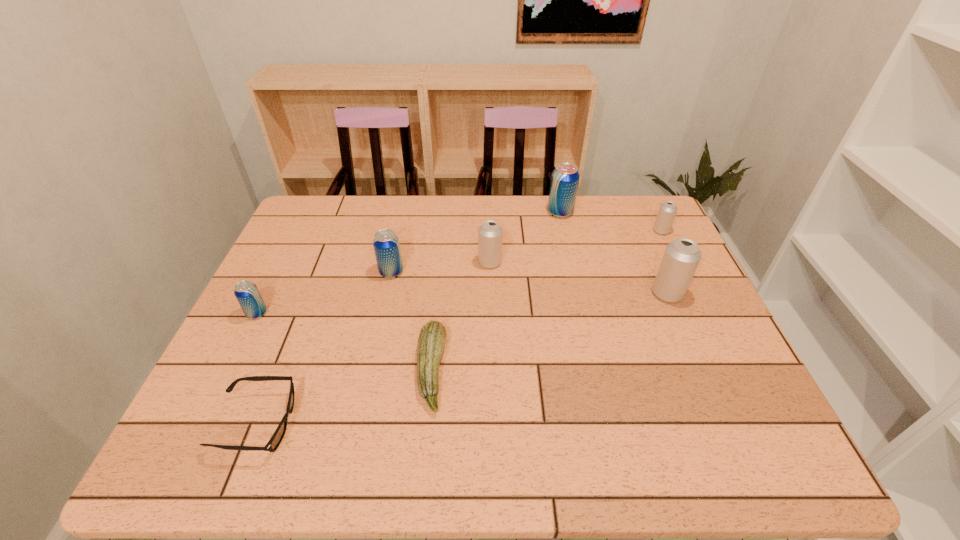
Identify the location of the second farthest beer can. This screenshot has width=960, height=540. (667, 211).

Locate an element on the screen. The height and width of the screenshot is (540, 960). the second farthest object is located at coordinates (667, 211).

Identify the location of the second shortest object. The width and height of the screenshot is (960, 540). (432, 338).

Find the location of a particular element. This screenshot has height=540, width=960. the fifth object from right to left is located at coordinates (432, 338).

Locate an element on the screen. sunglasses is located at coordinates (275, 440).

Locate an element on the screen. the second object from left to right is located at coordinates (275, 440).

You are a GUI agent. You are given a task and a screenshot of the screen. Output one action in this format:
    pyautogui.click(x=<x>, y=<y>)
    Task: Click on the vacant space located 0.260m on the front of the fourth beer can from left to right
    This screenshot has width=960, height=540.
    Given the screenshot: What is the action you would take?
    pyautogui.click(x=574, y=274)

Where is `vacant space located on the left of the biggest white beer can`? vacant space located on the left of the biggest white beer can is located at coordinates (578, 293).

This screenshot has height=540, width=960. I want to click on free space located 0.150m on the left of the second biggest white beer can, so click(x=427, y=262).

This screenshot has width=960, height=540. What are the coordinates of `vacant space located 0.060m on the left of the second smallest blue beer can` in the screenshot? It's located at (358, 272).